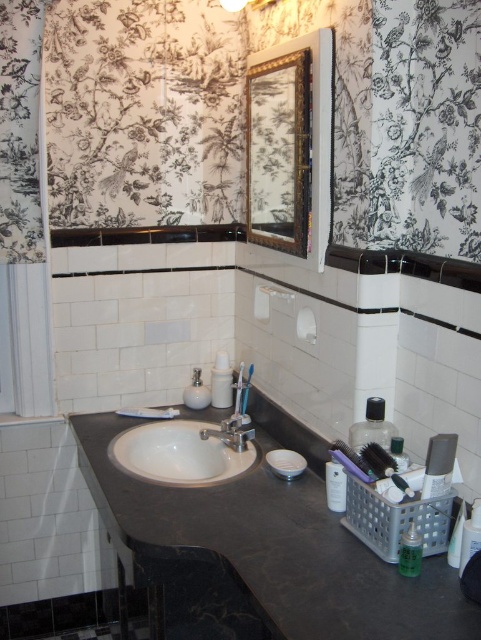
Is silver metallic faucet at center further to the viewer compared to clear plastic bottle at lower right?

That is True.

Between silver metallic faucet at center and clear plastic bottle at lower right, which one appears on the left side from the viewer's perspective?

From the viewer's perspective, silver metallic faucet at center appears more on the left side.

Who is more forward, (235, 433) or (467, 538)?

Point (467, 538)

Identify the location of silver metallic faucet at center. The height and width of the screenshot is (640, 481). (229, 433).

Does white plastic toothbrush at center appear on the right side of translucent plastic bottle at lower right?

No, white plastic toothbrush at center is not to the right of translucent plastic bottle at lower right.

Between point (227, 380) and point (450, 557), which one is positioned in front?

Point (450, 557)

Measure the distance between point (x=227, y=365) and camera.

Point (x=227, y=365) is 6.84 feet from camera.

This screenshot has height=640, width=481. Identify the location of white plastic toothbrush at center. (222, 381).

From the picture: Which is above, gold-framed mirror at upper center or translucent plastic container at center?

gold-framed mirror at upper center is above.

Locate an element on the screen. This screenshot has height=640, width=481. gold-framed mirror at upper center is located at coordinates (278, 152).